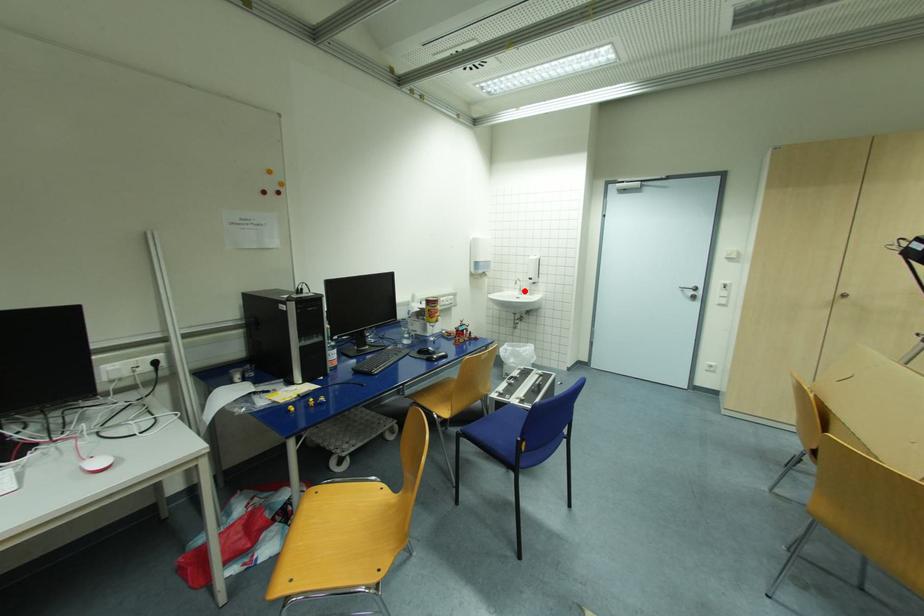
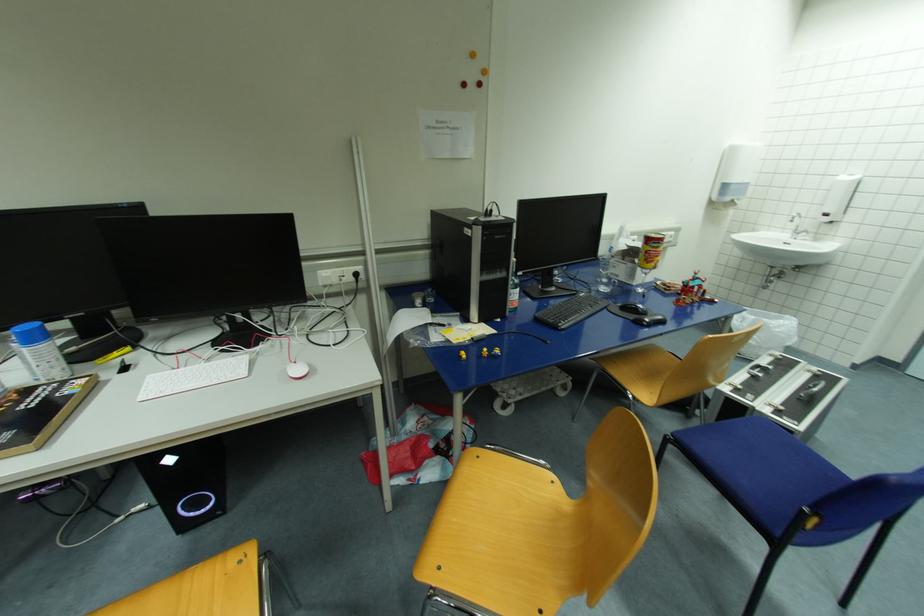
Where in the second image is the point corresponding to the highlighted location from the first image?

(799, 233)